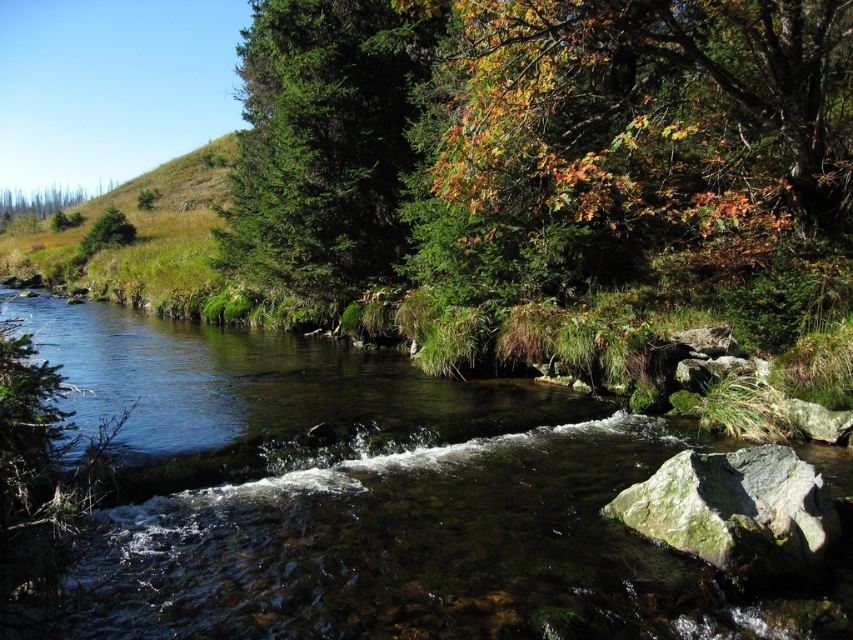
Can you confirm if green textured tree at center is positioned above green mossy rock at lower right?

Correct, green textured tree at center is located above green mossy rock at lower right.

Can you confirm if green textured tree at center is positioned to the right of green mossy rock at lower right?

Incorrect, green textured tree at center is not on the right side of green mossy rock at lower right.

Is point (286, 220) positioned after point (701, 513)?

Yes, it is.

What are the coordinates of `green textured tree at center` in the screenshot? It's located at (323, 145).

Does point (662, 468) come behind point (112, 240)?

No, it is in front of (112, 240).

What do you see at coordinates (735, 509) in the screenshot? This screenshot has width=853, height=640. I see `green mossy rock at lower right` at bounding box center [735, 509].

You are a GUI agent. You are given a task and a screenshot of the screen. Output one action in this format:
    pyautogui.click(x=<x>, y=<y>)
    Task: Click on the green mossy rock at lower right
    
    Given the screenshot: What is the action you would take?
    pyautogui.click(x=735, y=509)

Where is `green mossy rock at lower right`? The width and height of the screenshot is (853, 640). green mossy rock at lower right is located at coordinates click(735, 509).

Does point (286, 560) come farther from viewer compared to point (115, 241)?

No, it is in front of (115, 241).

Is clear water at center thinner than green matte tree at upper left?

No, clear water at center is not thinner than green matte tree at upper left.

Between point (364, 387) and point (114, 220), which one is positioned behind?

The point (114, 220) is behind.

You are a GUI agent. You are given a task and a screenshot of the screen. Output one action in this format:
    pyautogui.click(x=<x>, y=<y>)
    Task: Click on the clear water at center
    
    Given the screenshot: What is the action you would take?
    pyautogui.click(x=364, y=497)